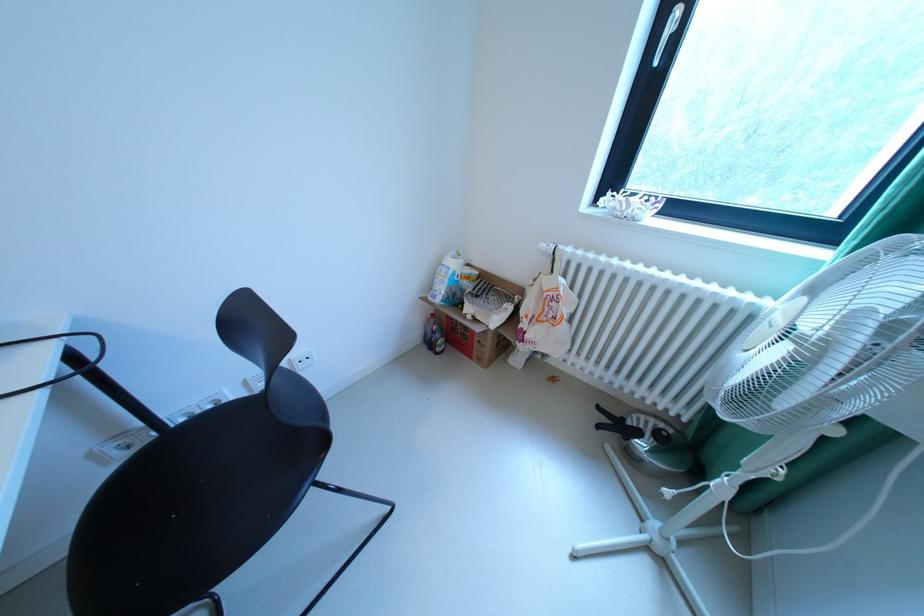
What do you see at coordinates (556, 308) in the screenshot? This screenshot has width=924, height=616. I see `a cloth bag handle` at bounding box center [556, 308].